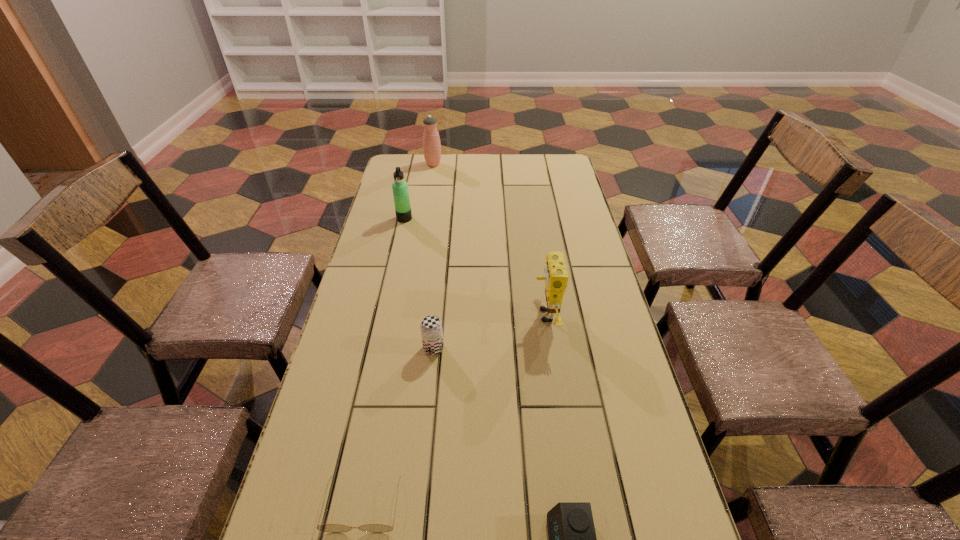
Identify the location of vacant space at the far left corner of the desktop. The width and height of the screenshot is (960, 540). (388, 168).

The width and height of the screenshot is (960, 540). I want to click on vacant region at the far right corner, so click(548, 164).

In order to click on vacant space in between the shortest object and the third shortest object in this screenshot , I will do `click(398, 426)`.

You are a GUI agent. You are given a task and a screenshot of the screen. Output one action in this format:
    pyautogui.click(x=<x>, y=<y>)
    Task: Click on the blank region between the farthest object and the shortest object
    Image resolution: width=960 pixels, height=540 pixels.
    Given the screenshot: What is the action you would take?
    pyautogui.click(x=397, y=334)

I want to click on vacant space in between the farther thermos bottle and the nearer thermos bottle, so click(419, 191).

Identify the location of empty space between the beer can and the shortest object. This screenshot has height=540, width=960. (398, 426).

Where is `free space between the third object from right to left and the sponge`? free space between the third object from right to left and the sponge is located at coordinates (490, 332).

Identify the location of vacant space that is in between the fourth tallest object and the left thermos bottle. (419, 284).

Where is `free space between the fifth nearest object and the beer can`? The width and height of the screenshot is (960, 540). free space between the fifth nearest object and the beer can is located at coordinates tap(419, 284).

Point out which object is positioned as the fifth nearest to the sunglasses. Please provide its 2D coordinates. Your answer should be formatted as a tuple, i.e. [(x, y)], where the tuple contains the x and y coordinates of a point satisfying the conditions above.

[(431, 141)]